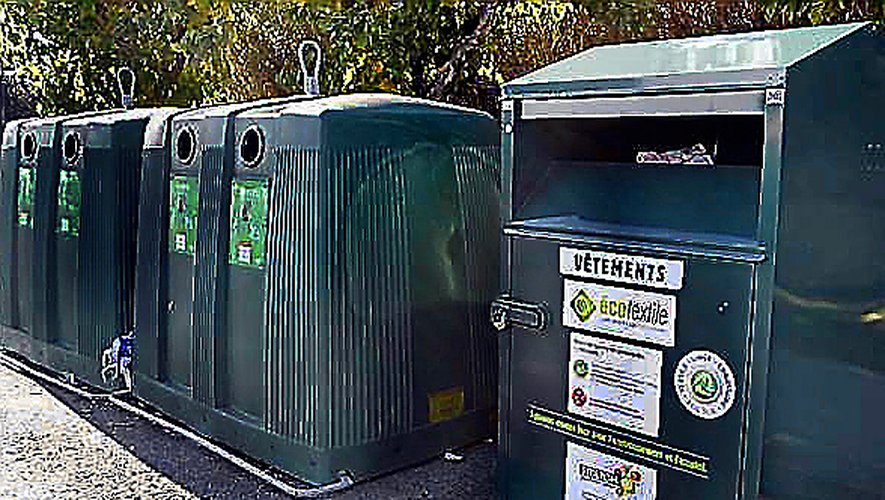
Where is `recycling bin`? This screenshot has height=500, width=885. recycling bin is located at coordinates (671, 254), (329, 244), (181, 250), (104, 228), (45, 211).